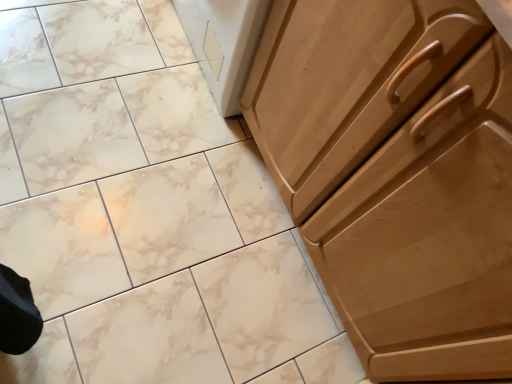
The image size is (512, 384). What do you see at coordinates (397, 174) in the screenshot?
I see `wooden cabinet at right` at bounding box center [397, 174].

Identify the location of wooden cabinet at right. (397, 174).

Locate an element on the screen. wooden cabinet at right is located at coordinates (397, 174).